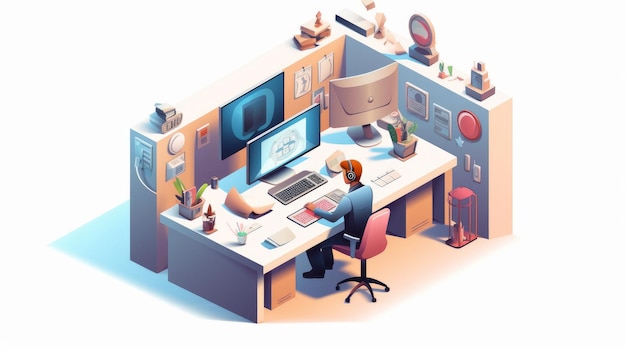
The width and height of the screenshot is (626, 351). I want to click on arm rest on chair, so click(352, 240).